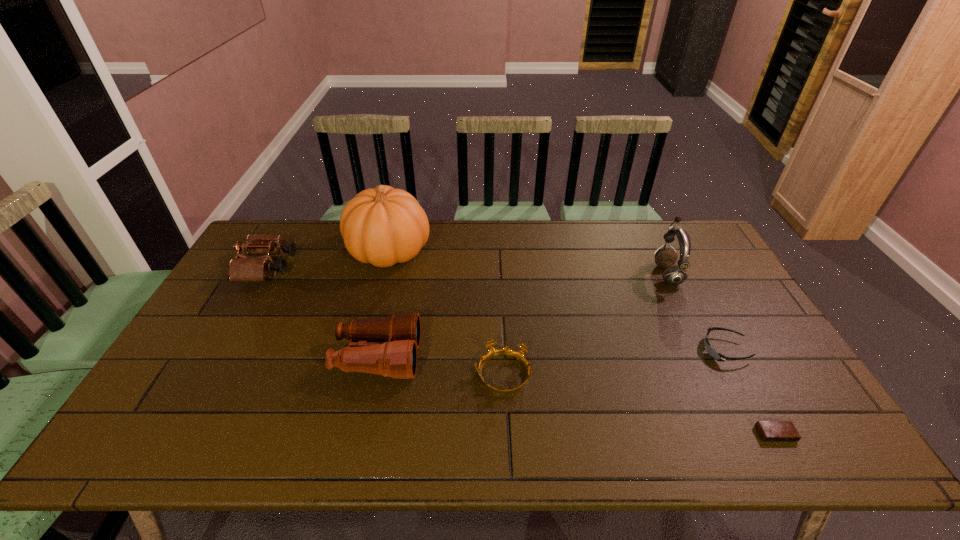
Identify the location of vacant area between the leftmost object and the pumpkin. (328, 260).

You are a GUI agent. You are given a task and a screenshot of the screen. Output one action in this format:
    pyautogui.click(x=<x>, y=<y>)
    Task: Click on the empty space between the shortest object and the tallest object
    Image resolution: width=960 pixels, height=540 pixels.
    Given the screenshot: What is the action you would take?
    pyautogui.click(x=583, y=343)

The height and width of the screenshot is (540, 960). What are the coordinates of `empty space that is in between the tallest object and the second tallest object` in the screenshot? It's located at [x=528, y=263].

Find the location of a particular element. The width and height of the screenshot is (960, 540). free area in between the crown and the earphone is located at coordinates (585, 325).

Where is `vacant space that's between the second tallest object and the crown`? vacant space that's between the second tallest object and the crown is located at coordinates (585, 325).

What are the coordinates of `free space between the shortest object and the earphone` in the screenshot? It's located at (721, 354).

You are a GUI agent. You are given a task and a screenshot of the screen. Output one action in this format:
    pyautogui.click(x=<x>, y=<y>)
    Task: Click on the object that is the fifth closest to the fourth object from right to left
    
    Given the screenshot: What is the action you would take?
    pyautogui.click(x=770, y=431)

At what (x,y) coordinates should I click in order to perform the action: click on the fifth closest object to the crown. Please return your answer as a coordinate pair (x, y). The width and height of the screenshot is (960, 540). Looking at the image, I should click on (770, 431).

Identify the location of vacant region that satisfies the following two spatial constraints: 1. through the lenses of the crown; 2. on the right side of the right binoculars. (374, 375).

At what (x,y) coordinates should I click in order to perform the action: click on vacant region that satisfies the following two spatial constraints: 1. through the eyepieces of the left binoculars; 2. on the back side of the fourth object from left to right. Please return your answer as a coordinate pair (x, y). The height and width of the screenshot is (540, 960). Looking at the image, I should click on (207, 375).